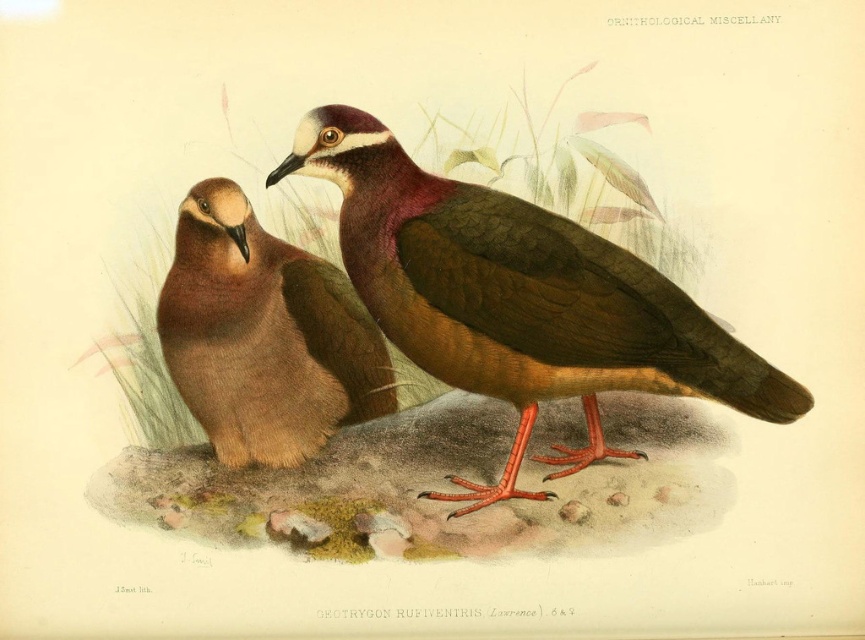
Question: Among these points, which one is nearest to the camera?

Choices:
 (A) (251, 237)
 (B) (469, 205)

Answer: (B)

Question: Which object appears closest to the camera in this image?

Choices:
 (A) brown matte bird at center
 (B) brown matte pigeon at left

Answer: (A)

Question: Where is brown matte bird at center located in relation to brown matte pigeon at left in the image?

Choices:
 (A) left
 (B) right

Answer: (B)

Question: Is brown matte bird at center further to the viewer compared to brown matte pigeon at left?

Choices:
 (A) no
 (B) yes

Answer: (A)

Question: Is brown matte bird at center bigger than brown matte pigeon at left?

Choices:
 (A) no
 (B) yes

Answer: (B)